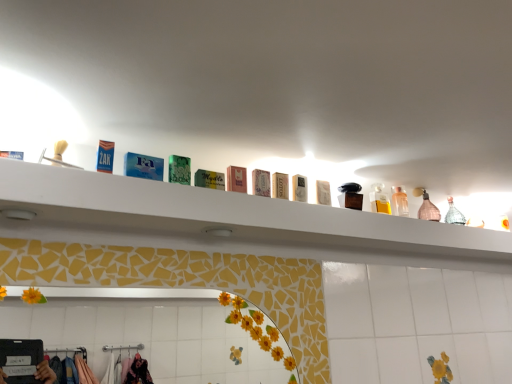
Question: Considering the relative sizes of clear plastic bottle at upper right, which appears as the first toiletry when viewed from the back, and clear plastic bottle at upper center in the image provided, is clear plastic bottle at upper right, which appears as the first toiletry when viewed from the back, shorter than clear plastic bottle at upper center?

Choices:
 (A) yes
 (B) no

Answer: (B)

Question: From the image's perspective, would you say clear plastic bottle at upper right, marked as the 8th toiletry in a left-to-right arrangement, is positioned over clear plastic bottle at upper center?

Choices:
 (A) yes
 (B) no

Answer: (B)

Question: From a real-world perspective, is clear plastic bottle at upper right, which appears as the first toiletry when viewed from the back, located beneath clear plastic bottle at upper center?

Choices:
 (A) yes
 (B) no

Answer: (B)

Question: Is clear plastic bottle at upper right, which appears as the first toiletry when viewed from the back, at the left side of clear plastic bottle at upper center?

Choices:
 (A) yes
 (B) no

Answer: (B)

Question: Considering the relative sizes of clear plastic bottle at upper right, the 1th toiletry positioned from the right, and clear plastic bottle at upper center in the image provided, is clear plastic bottle at upper right, the 1th toiletry positioned from the right, bigger than clear plastic bottle at upper center?

Choices:
 (A) yes
 (B) no

Answer: (A)

Question: Is clear plastic bottle at upper right, the 1th toiletry positioned from the right, further to camera compared to clear plastic bottle at upper center?

Choices:
 (A) yes
 (B) no

Answer: (A)

Question: From the image's perspective, is green matte soap at center, positioned as the seventh toiletry in back-to-front order, under pink glass bottle at upper right?

Choices:
 (A) yes
 (B) no

Answer: (B)

Question: From a real-world perspective, is green matte soap at center, positioned as the seventh toiletry in back-to-front order, over pink glass bottle at upper right?

Choices:
 (A) no
 (B) yes

Answer: (A)

Question: From the image's perspective, is green matte soap at center, the 2th toiletry in the front-to-back sequence, over pink glass bottle at upper right?

Choices:
 (A) yes
 (B) no

Answer: (A)

Question: Could you tell me if green matte soap at center, positioned as the seventh toiletry in right-to-left order, is turned towards pink glass bottle at upper right?

Choices:
 (A) no
 (B) yes

Answer: (A)

Question: Considering the relative sizes of green matte soap at center, the 2th toiletry in the front-to-back sequence, and pink glass bottle at upper right in the image provided, is green matte soap at center, the 2th toiletry in the front-to-back sequence, bigger than pink glass bottle at upper right?

Choices:
 (A) no
 (B) yes

Answer: (A)

Question: Is green matte soap at center, the 2th toiletry in the front-to-back sequence, facing away from pink glass bottle at upper right?

Choices:
 (A) yes
 (B) no

Answer: (B)

Question: From a real-world perspective, is matte pink soap at center, which ranks as the third toiletry in front-to-back order, physically above clear plastic bottle at upper right, which appears as the first toiletry when viewed from the back?

Choices:
 (A) no
 (B) yes

Answer: (A)